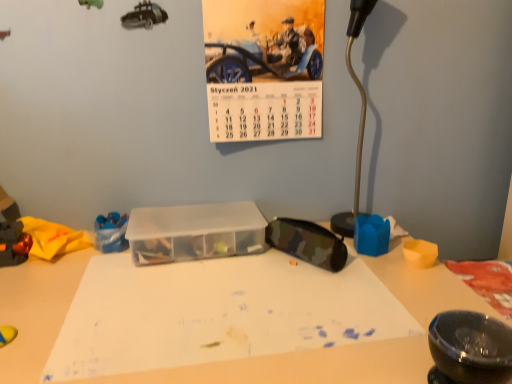
Question: From a real-world perspective, is shiny metallic toy car at left, the first toy in the left-to-right sequence, below camo fabric pouch at center-right?

Choices:
 (A) no
 (B) yes

Answer: (A)

Question: Does shiny metallic toy car at left, the third toy from the right, have a larger size compared to camo fabric pouch at center-right?

Choices:
 (A) yes
 (B) no

Answer: (A)

Question: From the image's perspective, is shiny metallic toy car at left, the third toy from the right, over camo fabric pouch at center-right?

Choices:
 (A) yes
 (B) no

Answer: (A)

Question: From a real-world perspective, is shiny metallic toy car at left, the first toy in the left-to-right sequence, over camo fabric pouch at center-right?

Choices:
 (A) no
 (B) yes

Answer: (B)

Question: Can you confirm if shiny metallic toy car at left, the third toy from the right, is smaller than camo fabric pouch at center-right?

Choices:
 (A) yes
 (B) no

Answer: (B)

Question: Is blue plastic toy at lower left, which ranks as the 2th toy in right-to-left order, inside or outside of camo fabric pouch at center-right?

Choices:
 (A) outside
 (B) inside

Answer: (A)

Question: Considering their positions, is blue plastic toy at lower left, acting as the 2th toy starting from the left, located in front of or behind camo fabric pouch at center-right?

Choices:
 (A) front
 (B) behind

Answer: (B)

Question: Considering the relative positions of blue plastic toy at lower left, which ranks as the 2th toy in right-to-left order, and camo fabric pouch at center-right in the image provided, is blue plastic toy at lower left, which ranks as the 2th toy in right-to-left order, to the left or to the right of camo fabric pouch at center-right?

Choices:
 (A) right
 (B) left

Answer: (B)

Question: Considering the positions of blue plastic toy at lower left, which ranks as the 2th toy in right-to-left order, and camo fabric pouch at center-right in the image, is blue plastic toy at lower left, which ranks as the 2th toy in right-to-left order, bigger or smaller than camo fabric pouch at center-right?

Choices:
 (A) big
 (B) small

Answer: (B)

Question: Considering the positions of transparent plastic container at center and metallic silver lamp at right in the image, is transparent plastic container at center bigger or smaller than metallic silver lamp at right?

Choices:
 (A) big
 (B) small

Answer: (B)

Question: In terms of width, does transparent plastic container at center look wider or thinner when compared to metallic silver lamp at right?

Choices:
 (A) wide
 (B) thin

Answer: (A)

Question: From the image's perspective, is transparent plastic container at center positioned above or below metallic silver lamp at right?

Choices:
 (A) above
 (B) below

Answer: (B)

Question: In terms of height, does transparent plastic container at center look taller or shorter compared to metallic silver lamp at right?

Choices:
 (A) tall
 (B) short

Answer: (B)

Question: Is shiny metallic toy car at left, the first toy in the left-to-right sequence, bigger or smaller than transparent plastic container at center?

Choices:
 (A) big
 (B) small

Answer: (A)

Question: Does point (59, 233) appear closer or farther from the camera than point (137, 246)?

Choices:
 (A) farther
 (B) closer

Answer: (A)